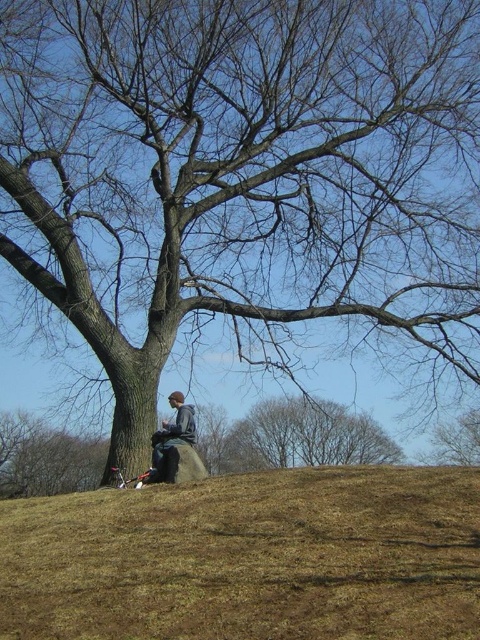
Looking at this image, you are a photographer trying to capture a photo of the brown leafless tree at upper center and the gray fleece jacket at center. Since you want the tree to appear larger in the photo than the jacket, which object should you focus on to ensure proper framing?

The brown leafless tree at upper center is taller than the gray fleece jacket at center, so focusing on the tree will ensure it appears larger in the photo.

From the picture: You are standing in the outdoor scene and want to take a photo of the brown leafless tree at upper center without the gray fleece jacket at center blocking the view. Is the tree visible above or below the jacket?

The brown leafless tree at upper center is below the gray fleece jacket at center, so the tree is positioned lower than the jacket. Therefore, the tree would be visible below the jacket and might not be blocked if you angle the camera downward.

You are a painter standing 2 meters away from the brown leafless tree at upper center. You want to paint the brown rough tree at center. Can you reach it without moving closer?

The distance between the brown rough tree at center and the brown leafless tree at upper center is 1.70 meters. Since you are 2 meters away from the brown leafless tree at upper center, the brown rough tree at center is only 0.3 meters away from you. Therefore, you can easily reach it without moving closer.